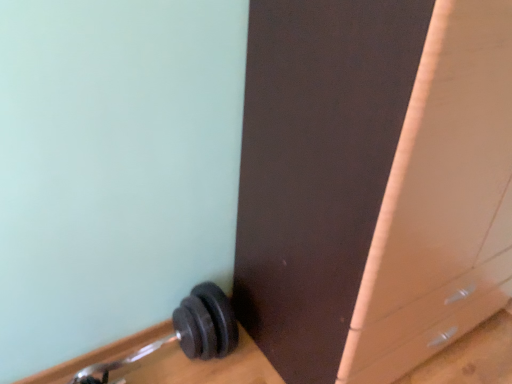
Question: Relative to matte brown file cabinet at lower right, is black rubber dumbbell at lower left in front or behind?

Choices:
 (A) behind
 (B) front

Answer: (A)

Question: Considering the relative positions of black rubber dumbbell at lower left and matte brown file cabinet at lower right in the image provided, is black rubber dumbbell at lower left to the left or to the right of matte brown file cabinet at lower right?

Choices:
 (A) right
 (B) left

Answer: (B)

Question: Looking at their shapes, would you say black rubber dumbbell at lower left is wider or thinner than matte brown file cabinet at lower right?

Choices:
 (A) wide
 (B) thin

Answer: (B)

Question: Based on their positions, is matte brown file cabinet at lower right located to the left or right of black rubber dumbbell at lower left?

Choices:
 (A) right
 (B) left

Answer: (A)

Question: Does point (425, 225) appear closer or farther from the camera than point (86, 375)?

Choices:
 (A) closer
 (B) farther

Answer: (A)

Question: From a real-world perspective, is matte brown file cabinet at lower right above or below black rubber dumbbell at lower left?

Choices:
 (A) below
 (B) above

Answer: (B)

Question: Is matte brown file cabinet at lower right bigger or smaller than black rubber dumbbell at lower left?

Choices:
 (A) big
 (B) small

Answer: (A)